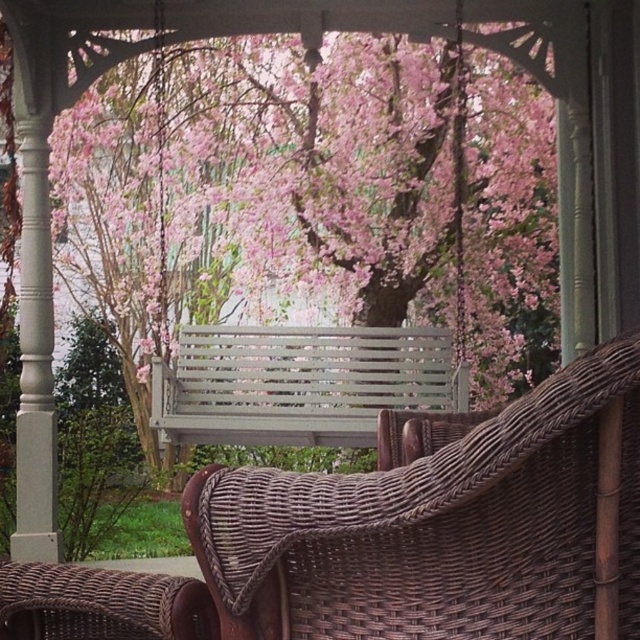
You are sitting on the gray slatted bench at center and want to look at the pink blossoms at center. Can you see them clearly from your current position?

The gray slatted bench at center is behind the pink blossoms at center, so you are positioned behind them. This means the pink blossoms at center are in front of you, so you can see them clearly from your current position on the gray slatted bench at center.

You are planning to place a large potted plant between the brown wicker armchair at center and the gray slatted bench at center. Considering their sizes, which object should the plant be closer to?

The brown wicker armchair at center has a smaller size compared to the gray slatted bench at center, so the plant should be placed closer to the gray slatted bench at center to maintain balance.